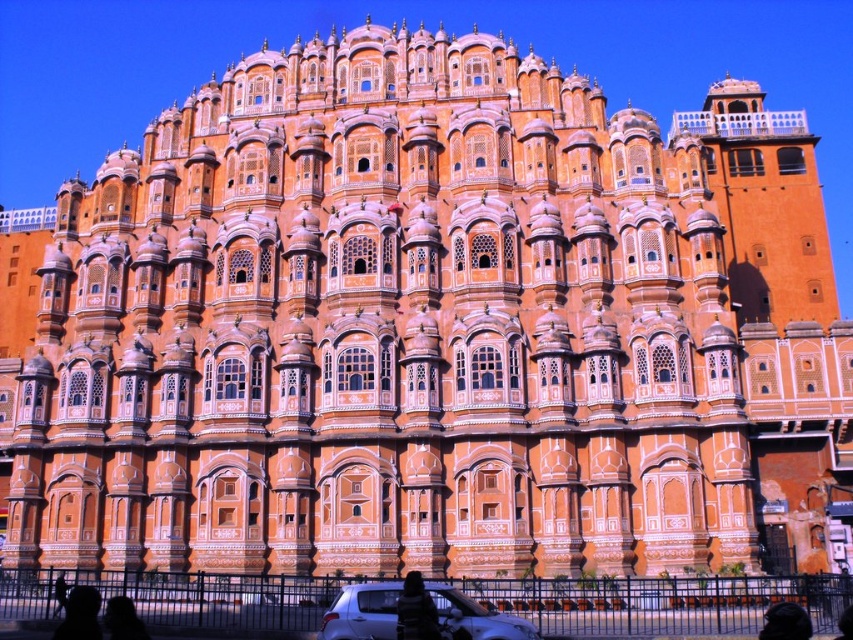
Question: Does dark gray fabric jacket at lower center appear under silhouette figure at lower left?

Choices:
 (A) yes
 (B) no

Answer: (B)

Question: Which point is farther to the camera?

Choices:
 (A) (126, 637)
 (B) (399, 636)
 (C) (776, 634)

Answer: (B)

Question: Among these points, which one is farthest from the camera?

Choices:
 (A) (421, 637)
 (B) (120, 636)

Answer: (A)

Question: Which object appears closest to the camera in this image?

Choices:
 (A) dark gray fabric jacket at lower center
 (B) silhouette skin at lower left
 (C) black fabric at lower right

Answer: (B)

Question: Is dark gray fabric jacket at lower center below black fabric at lower right?

Choices:
 (A) no
 (B) yes

Answer: (A)

Question: Does dark gray fabric jacket at lower center appear over silhouette figure at lower left?

Choices:
 (A) no
 (B) yes

Answer: (B)